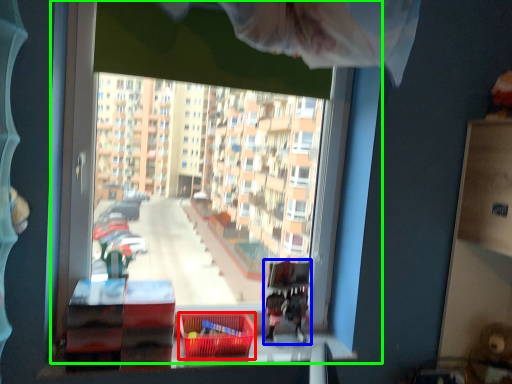
Question: Which is nearer to the basket (highlighted by a red box)? bunk bed (highlighted by a blue box) or window (highlighted by a green box).

Choices:
 (A) bunk bed
 (B) window

Answer: (A)